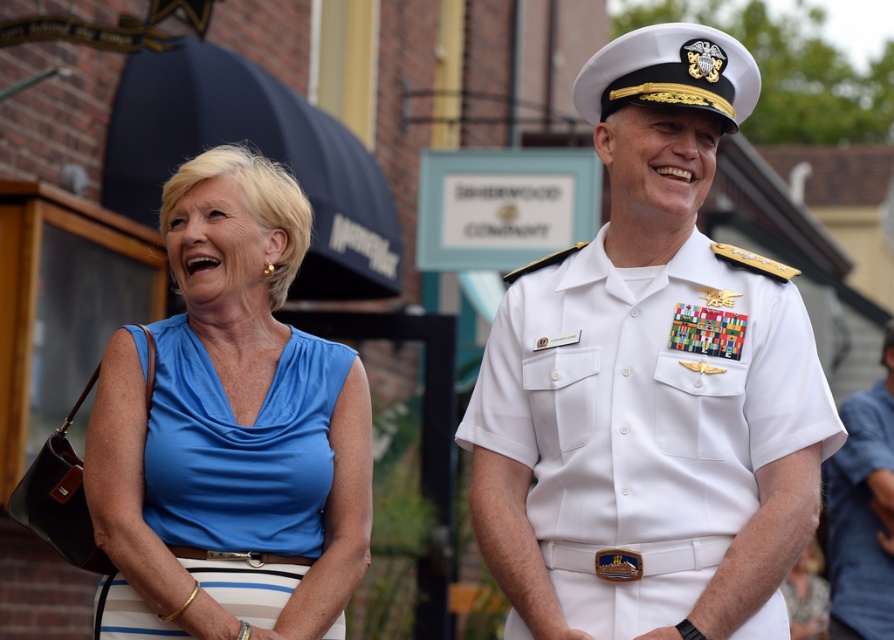
You are a photographer trying to capture both individuals in a single frame. Given that the white uniform at center and the white uniform at right are positioned differently, which one is closer to the camera?

The white uniform at center is shorter than the white uniform at right, so the white uniform at center is closer to the camera.

You are a photographer trying to capture a group photo of the white uniform at center and the satin blue blouse at left. Which person should stand in the front row so their head is visible in the photo?

The white uniform at center should stand in the front row because it has a lesser height compared to the satin blue blouse at left, ensuring their head remains visible.

You are a photographer trying to capture a group photo of the white uniform at center and the satin blue blouse at left. The camera you are using has a maximum focus range of 4 meters. Can you include both subjects in the frame without needing to adjust your position?

The distance between the white uniform at center and the satin blue blouse at left is 3.85 meters, which is within the camera maximum focus range of 4 meters. Therefore, you can include both subjects in the frame without needing to adjust your position.